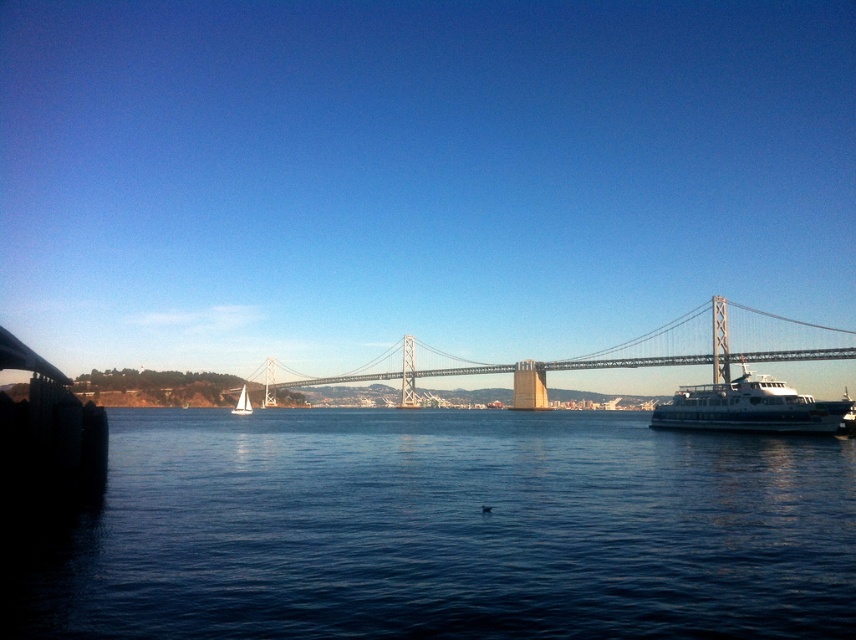
Question: Which object appears closest to the camera in this image?

Choices:
 (A) blue water at lower center
 (B) white glossy cruise ship at right
 (C) metallic gray suspension bridge at center

Answer: (A)

Question: Which of the following is the farthest from the observer?

Choices:
 (A) (241, 404)
 (B) (617, 458)
 (C) (666, 333)
 (D) (752, 372)

Answer: (C)

Question: Which is farther from the white glossy cruise ship at right?

Choices:
 (A) metallic gray suspension bridge at center
 (B) blue water at lower center

Answer: (A)

Question: Is blue water at lower center behind metallic gray suspension bridge at center?

Choices:
 (A) yes
 (B) no

Answer: (B)

Question: Is blue water at lower center bigger than metallic gray suspension bridge at center?

Choices:
 (A) no
 (B) yes

Answer: (A)

Question: Is blue water at lower center below metallic gray suspension bridge at center?

Choices:
 (A) no
 (B) yes

Answer: (B)